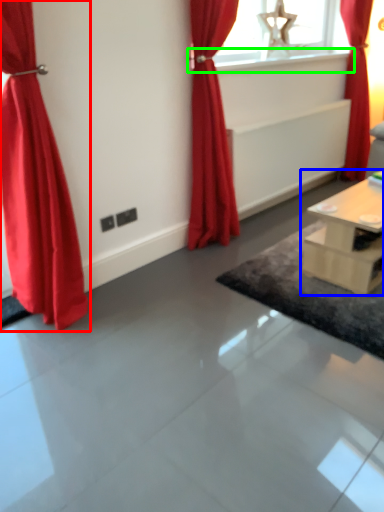
Question: Which object is the closest to the curtain (highlighted by a red box)? Choose among these: table (highlighted by a blue box) or window sill (highlighted by a green box).

Choices:
 (A) table
 (B) window sill

Answer: (A)